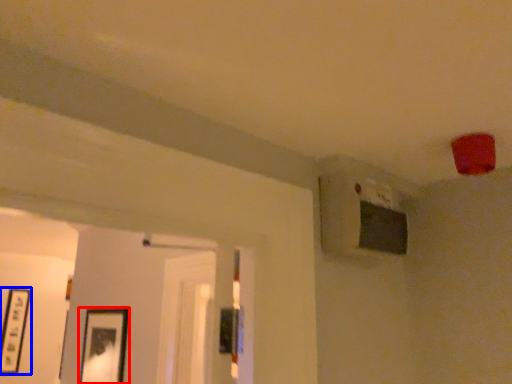
Question: Which point is further to the camera, picture frame (highlighted by a red box) or picture frame (highlighted by a blue box)?

Choices:
 (A) picture frame
 (B) picture frame

Answer: (B)